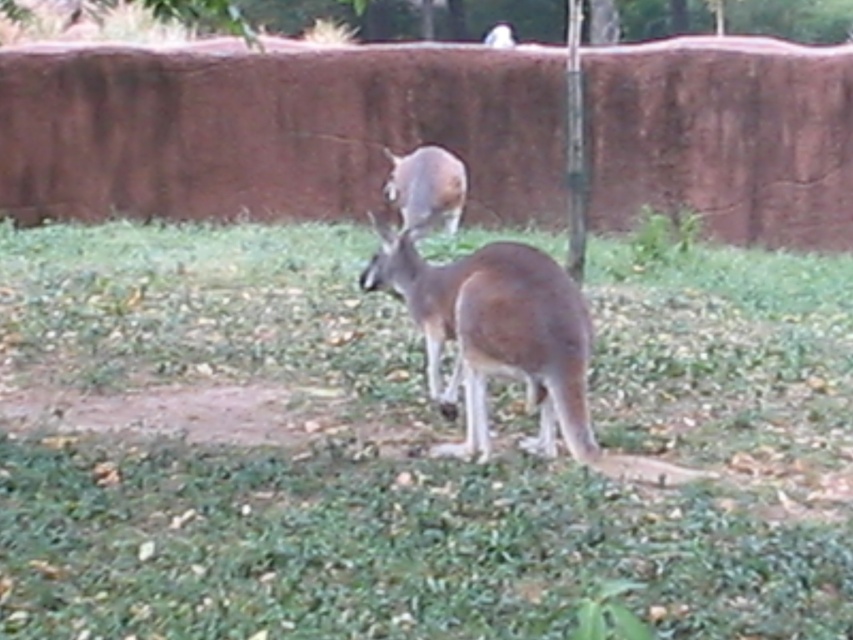
Which is below, brown furry kangaroo at center or green leafy tree at upper center?

brown furry kangaroo at center is lower down.

Who is more forward, [508,294] or [373,36]?

Point [508,294] is in front.

Identify the location of brown furry kangaroo at center. The height and width of the screenshot is (640, 853). (506, 342).

Can you confirm if brown furry kangaroo at center is taller than brown fur kangaroo at center?

Correct, brown furry kangaroo at center is much taller as brown fur kangaroo at center.

Does point (534, 445) lie behind point (432, 211)?

No.

You are a GUI agent. You are given a task and a screenshot of the screen. Output one action in this format:
    pyautogui.click(x=<x>, y=<y>)
    Task: Click on the brown furry kangaroo at center
    This screenshot has width=853, height=640.
    Given the screenshot: What is the action you would take?
    pyautogui.click(x=506, y=342)

Who is more distant from viewer, (639, 616) or (389, 252)?

The point (389, 252) is more distant.

You are a GUI agent. You are given a task and a screenshot of the screen. Output one action in this format:
    pyautogui.click(x=<x>, y=<y>)
    Task: Click on the green grassy at center
    
    Given the screenshot: What is the action you would take?
    pyautogui.click(x=403, y=445)

Where is `green grassy at center`? The height and width of the screenshot is (640, 853). green grassy at center is located at coordinates (403, 445).